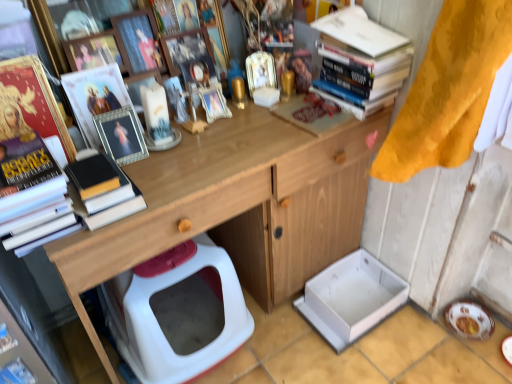
Question: Are matte plastic toy at upper center and white glossy plate at lower right making contact?

Choices:
 (A) no
 (B) yes

Answer: (A)

Question: From the image's perspective, is matte plastic toy at upper center over white glossy plate at lower right?

Choices:
 (A) yes
 (B) no

Answer: (A)

Question: From the image's perspective, does matte plastic toy at upper center appear lower than white glossy plate at lower right?

Choices:
 (A) no
 (B) yes

Answer: (A)

Question: Considering the relative positions of matte plastic toy at upper center and white glossy plate at lower right in the image provided, is matte plastic toy at upper center to the left of white glossy plate at lower right from the viewer's perspective?

Choices:
 (A) no
 (B) yes

Answer: (B)

Question: Considering the relative sizes of matte plastic toy at upper center and white glossy plate at lower right in the image provided, is matte plastic toy at upper center shorter than white glossy plate at lower right?

Choices:
 (A) yes
 (B) no

Answer: (B)

Question: Is matte plastic toy at upper center not near white glossy plate at lower right?

Choices:
 (A) no
 (B) yes

Answer: (A)

Question: Is the depth of hardcover books at upper right, the first book viewed from the right, less than that of matte plastic toy at upper center?

Choices:
 (A) yes
 (B) no

Answer: (A)

Question: Can you confirm if hardcover books at upper right, marked as the second book in a left-to-right arrangement, is thinner than matte plastic toy at upper center?

Choices:
 (A) no
 (B) yes

Answer: (A)

Question: Is matte plastic toy at upper center at the back of hardcover books at upper right, marked as the second book in a left-to-right arrangement?

Choices:
 (A) no
 (B) yes

Answer: (B)

Question: From the image's perspective, is hardcover books at upper right, the first book viewed from the right, over matte plastic toy at upper center?

Choices:
 (A) yes
 (B) no

Answer: (A)

Question: Is hardcover books at upper right, the first book viewed from the right, not within matte plastic toy at upper center?

Choices:
 (A) no
 (B) yes

Answer: (B)

Question: Is hardcover books at upper right, the first book viewed from the right, smaller than matte plastic toy at upper center?

Choices:
 (A) no
 (B) yes

Answer: (A)

Question: Is matte plastic toy at upper center positioned beyond the bounds of wooden at upper center?

Choices:
 (A) no
 (B) yes

Answer: (B)